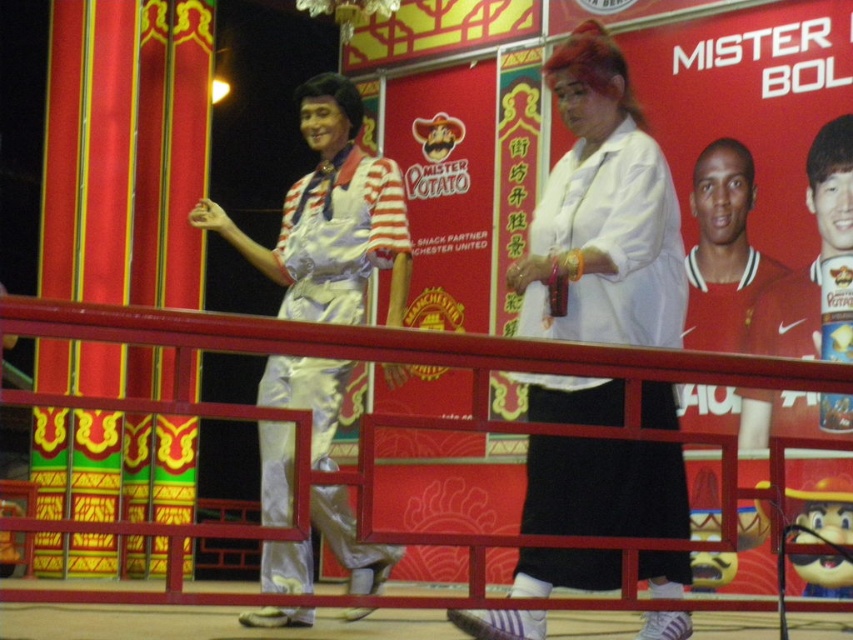
Question: From the image, what is the correct spatial relationship of white matte shirt at center in relation to red jersey at center?

Choices:
 (A) right
 (B) left

Answer: (B)

Question: Among these objects, which one is nearest to the camera?

Choices:
 (A) red jersey at center
 (B) metallic red railing at center
 (C) shiny silver jumpsuit at left
 (D) white matte shirt at center

Answer: (B)

Question: Is shiny silver jumpsuit at left wider than red jersey at center?

Choices:
 (A) no
 (B) yes

Answer: (B)

Question: Is metallic red railing at center above red jersey at center?

Choices:
 (A) yes
 (B) no

Answer: (B)

Question: Which point is closer to the camera?

Choices:
 (A) pyautogui.click(x=544, y=344)
 (B) pyautogui.click(x=573, y=225)
 (C) pyautogui.click(x=738, y=198)

Answer: (A)

Question: Which object appears farthest from the camera in this image?

Choices:
 (A) shiny silver jumpsuit at left
 (B) red jersey at center

Answer: (B)